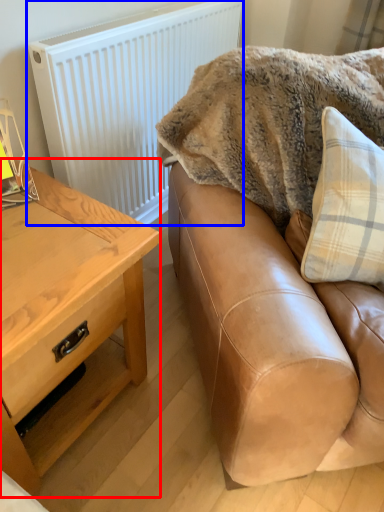
Question: Which of the following is the farthest to the observer, table (highlighted by a red box) or radiator (highlighted by a blue box)?

Choices:
 (A) table
 (B) radiator

Answer: (B)